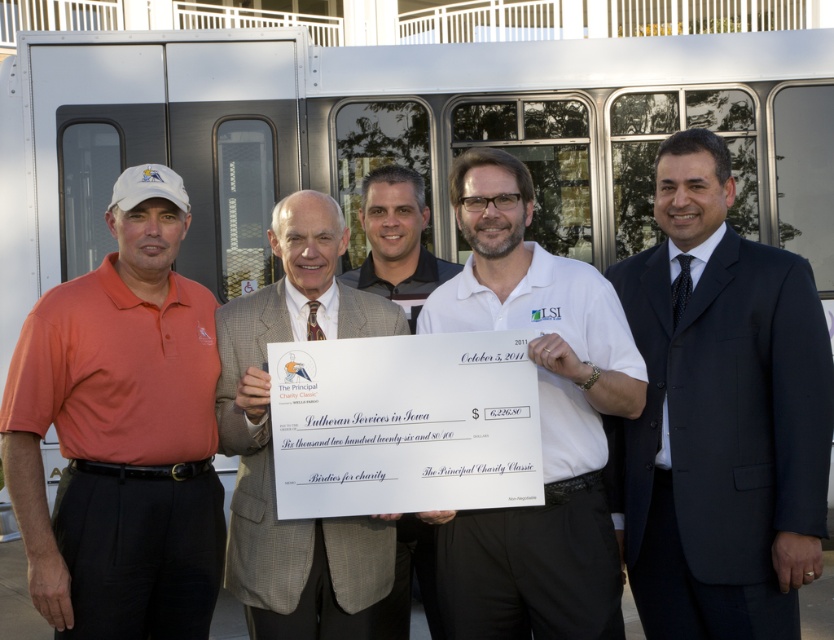
You are a photographer taking a group photo of the five men in front of the bus. You notice the orange matte shirt at left and the white paper check at center. Which of these two items should you focus on first to ensure they are in sharp focus, considering their sizes?

The orange matte shirt at left is thinner than the white paper check at center, so you should focus on the white paper check at center first because it is larger and might be easier to capture in sharp focus.

You are standing 2 meters away from the camera. You want to take a photo of the orange matte shirt at left. Is the shirt within your camera range if the camera has a maximum range of 5 meters?

The orange matte shirt at left is 3.21 meters from camera. Since you are 2 meters away from the camera, the total distance between you and the shirt is 5.21 meters, which exceeds the camera maximum range of 5 meters. Therefore, the shirt is out of range.

In the scene shown: You are standing in front of the large white bus and want to find the orange matte shirt at left. Based on the coordinates provided, which direction should you look relative to the bus?

The orange matte shirt at left is located at coordinates point [121,433], which means it is positioned to the left side of the bus. Therefore, you should look to the left of the bus to find it.